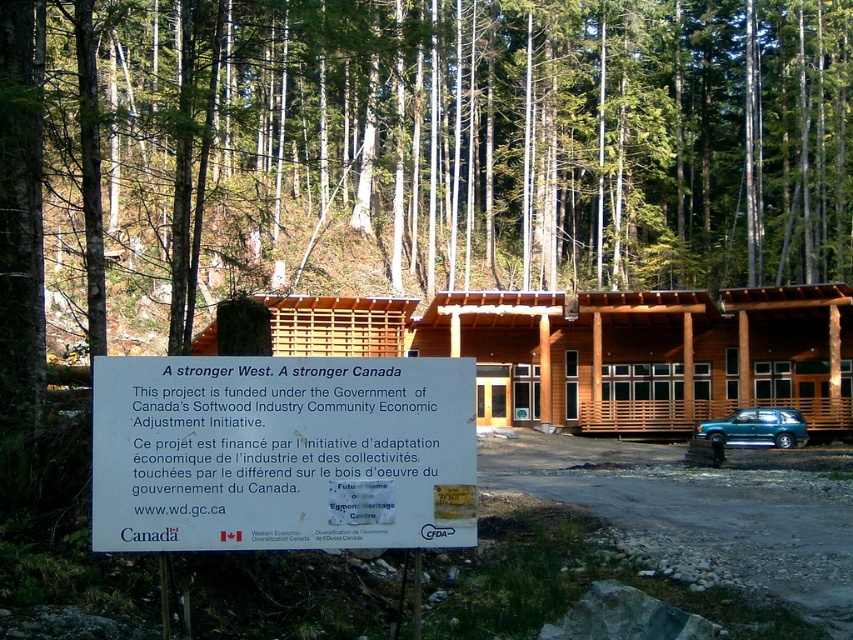
What do you see at coordinates (608, 349) in the screenshot? The image size is (853, 640). I see `wooden cabin at center` at bounding box center [608, 349].

The height and width of the screenshot is (640, 853). I want to click on wooden cabin at center, so click(x=608, y=349).

Is white paper sign at center to the left of teal glossy car at lower right from the viewer's perspective?

Yes, white paper sign at center is to the left of teal glossy car at lower right.

The width and height of the screenshot is (853, 640). I want to click on white paper sign at center, so click(x=282, y=452).

Who is shorter, white paper sign at center or wooden cabin at center?

white paper sign at center is shorter.

Is white paper sign at center taller than wooden cabin at center?

Incorrect, white paper sign at center's height is not larger of wooden cabin at center's.

Image resolution: width=853 pixels, height=640 pixels. Identify the location of white paper sign at center. tap(282, 452).